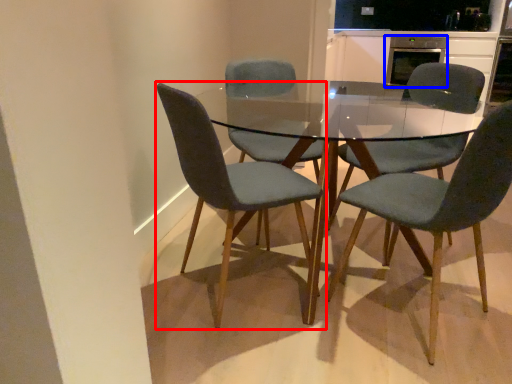
Question: Which point is closer to the camera, chair (highlighted by a red box) or appliance (highlighted by a blue box)?

Choices:
 (A) chair
 (B) appliance

Answer: (A)